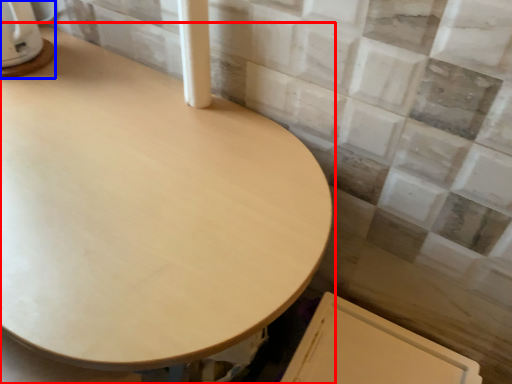
Question: Which of the following is the closest to the observer, table (highlighted by a red box) or appliance (highlighted by a blue box)?

Choices:
 (A) table
 (B) appliance

Answer: (A)